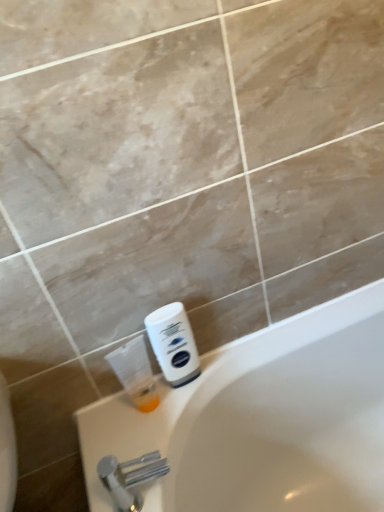
Question: From the image's perspective, is translucent plastic bottle at lower left below silver metallic faucet at lower left?

Choices:
 (A) no
 (B) yes

Answer: (A)

Question: Can you confirm if translucent plastic bottle at lower left is shorter than silver metallic faucet at lower left?

Choices:
 (A) no
 (B) yes

Answer: (A)

Question: From a real-world perspective, is translucent plastic bottle at lower left under silver metallic faucet at lower left?

Choices:
 (A) no
 (B) yes

Answer: (A)

Question: Is translucent plastic bottle at lower left smaller than silver metallic faucet at lower left?

Choices:
 (A) yes
 (B) no

Answer: (B)

Question: Is translucent plastic bottle at lower left behind silver metallic faucet at lower left?

Choices:
 (A) yes
 (B) no

Answer: (A)

Question: Is translucent plastic bottle at lower left at the left side of silver metallic faucet at lower left?

Choices:
 (A) no
 (B) yes

Answer: (B)

Question: Does translucent plastic bottle at lower left have a larger size compared to white matte shaving cream at lower right?

Choices:
 (A) no
 (B) yes

Answer: (B)

Question: Considering the relative positions of translucent plastic bottle at lower left and white matte shaving cream at lower right in the image provided, is translucent plastic bottle at lower left to the right of white matte shaving cream at lower right from the viewer's perspective?

Choices:
 (A) no
 (B) yes

Answer: (A)

Question: Is translucent plastic bottle at lower left positioned far away from white matte shaving cream at lower right?

Choices:
 (A) yes
 (B) no

Answer: (B)

Question: Would you say translucent plastic bottle at lower left contains white matte shaving cream at lower right?

Choices:
 (A) yes
 (B) no

Answer: (B)

Question: Is translucent plastic bottle at lower left not inside white matte shaving cream at lower right?

Choices:
 (A) yes
 (B) no

Answer: (A)

Question: Is translucent plastic bottle at lower left smaller than white matte shaving cream at lower right?

Choices:
 (A) yes
 (B) no

Answer: (B)

Question: Is white matte shaving cream at lower right surrounded by silver metallic faucet at lower left?

Choices:
 (A) yes
 (B) no

Answer: (B)